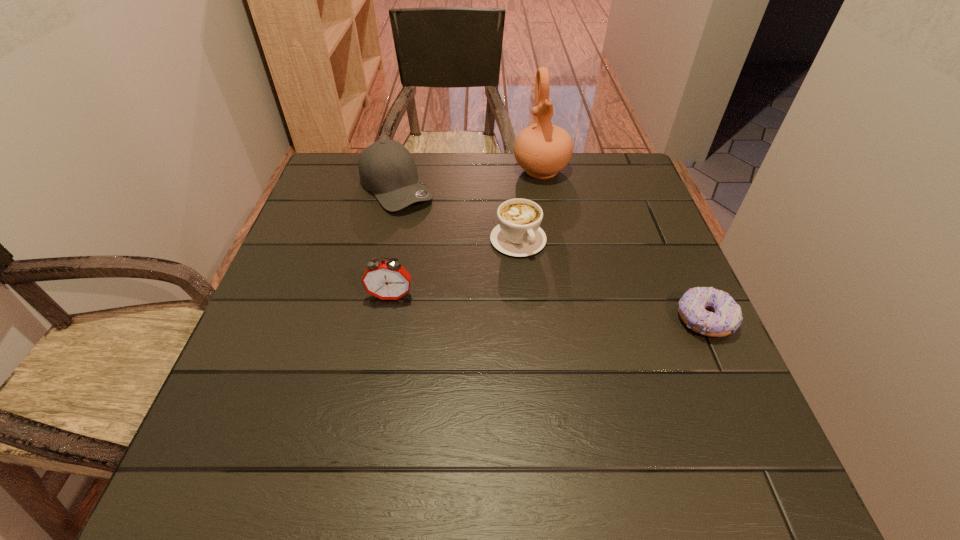
Where is `vacant space that satisfies the following two spatial constraints: 1. on the clock face of the doughnut; 2. on the right side of the alarm clock`? The width and height of the screenshot is (960, 540). vacant space that satisfies the following two spatial constraints: 1. on the clock face of the doughnut; 2. on the right side of the alarm clock is located at coordinates (387, 319).

The height and width of the screenshot is (540, 960). What are the coordinates of `free space in the image that satisfies the following two spatial constraints: 1. on the clock face of the rightmost object; 2. on the left side of the alarm clock` in the screenshot? It's located at (387, 319).

Where is `blank space that satisfies the following two spatial constraints: 1. on the clock face of the doughnut; 2. on the left side of the alarm clock`? Image resolution: width=960 pixels, height=540 pixels. blank space that satisfies the following two spatial constraints: 1. on the clock face of the doughnut; 2. on the left side of the alarm clock is located at coordinates (387, 319).